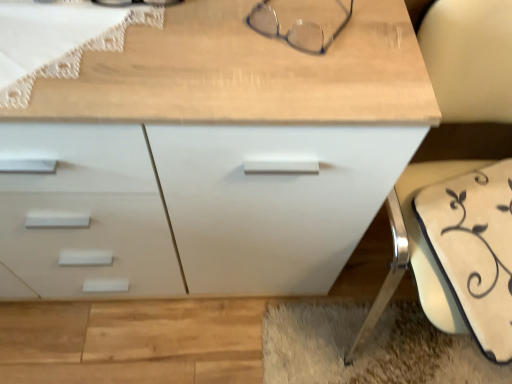
Locate an element on the screen. The image size is (512, 384). empty space that is to the right of clear plastic glasses at upper center is located at coordinates (388, 40).